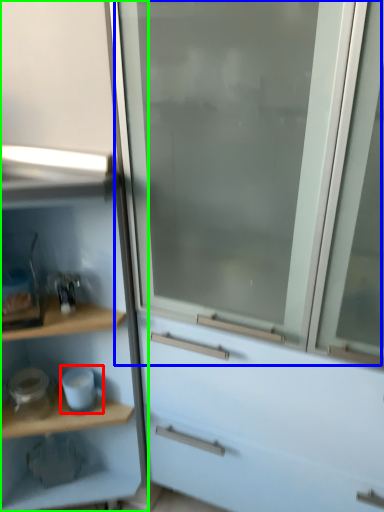
Question: Considering the real-world distances, which object is farthest from appliance (highlighted by a red box)? screen door (highlighted by a blue box) or cupboard (highlighted by a green box)?

Choices:
 (A) screen door
 (B) cupboard

Answer: (A)